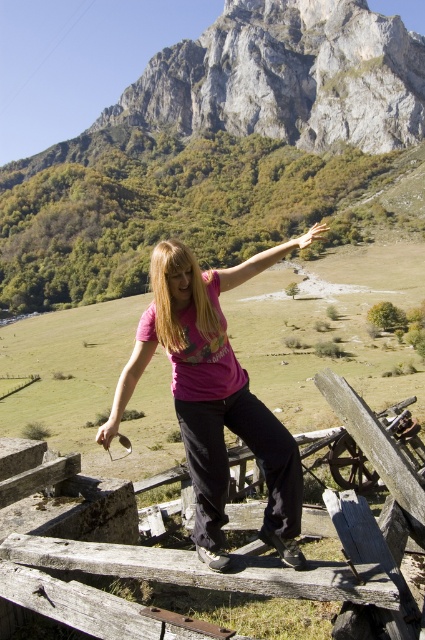
You are a photographer planning to take a portrait of the person wearing the pink matte shirt at center. You want to ensure the weathered wood fence at center is visible in the background but not too prominent. Based on the scene description, will the fence be less noticeable compared to the shirt?

The weathered wood fence at center occupies less space than pink matte shirt at center, so yes, the fence will be less noticeable compared to the shirt.

You are a photographer trying to capture a photo of the pink matte shirt at center and the weathered wood fence at center. From your current position, which object is located to the right of the other?

The weathered wood fence at center is positioned on the right side of pink matte shirt at center, so the weathered wood fence at center is to the right of the pink matte shirt at center.